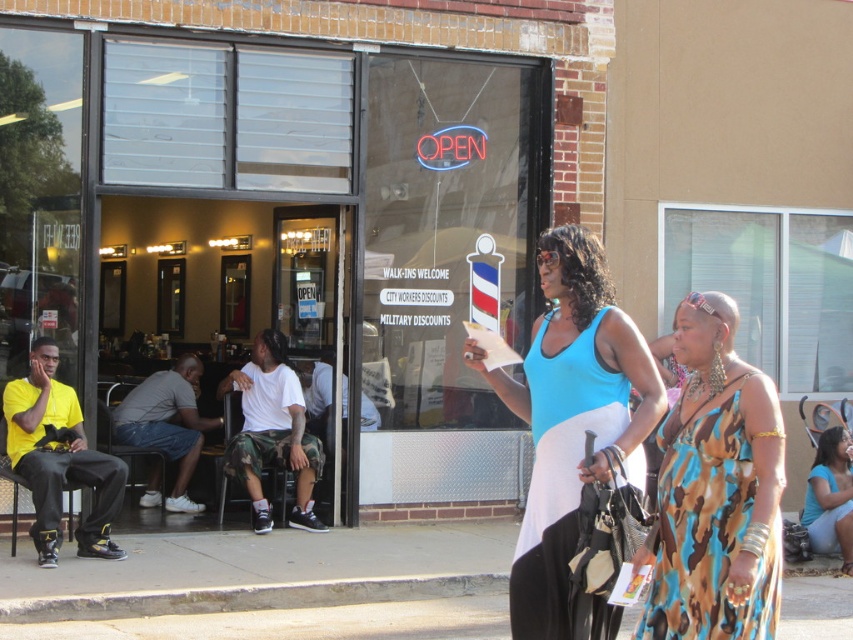
You are a customer entering the barbershop and see the camouflage print dress at right and the blue jersey dress at center. Which dress takes up more horizontal space in the image?

The camouflage print dress at right might be wider than blue jersey dress at center, so it likely occupies more horizontal space in the image.